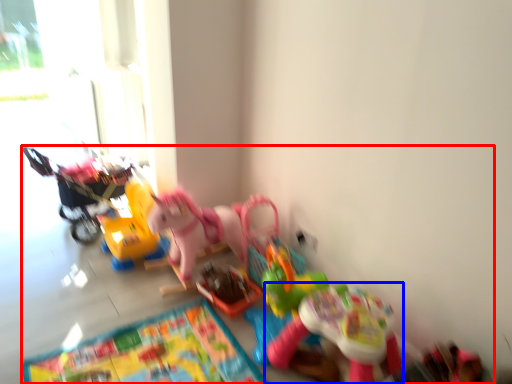
Question: Among these objects, which one is nearest to the camera, toy (highlighted by a red box) or toy (highlighted by a blue box)?

Choices:
 (A) toy
 (B) toy

Answer: (A)